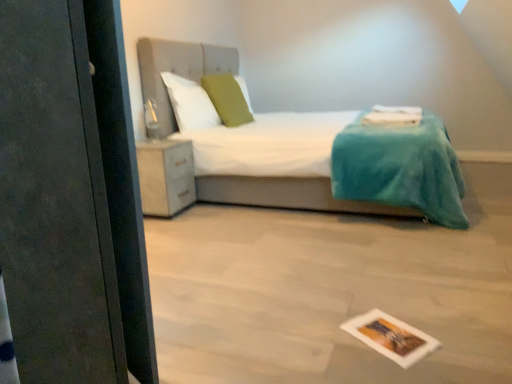
At what (x,y) coordinates should I click in order to perform the action: click on vacant area that lies between matte white cabinet at lower left and printed paper postcard at lower center. Please return your answer as a coordinate pair (x, y). Looking at the image, I should click on (247, 259).